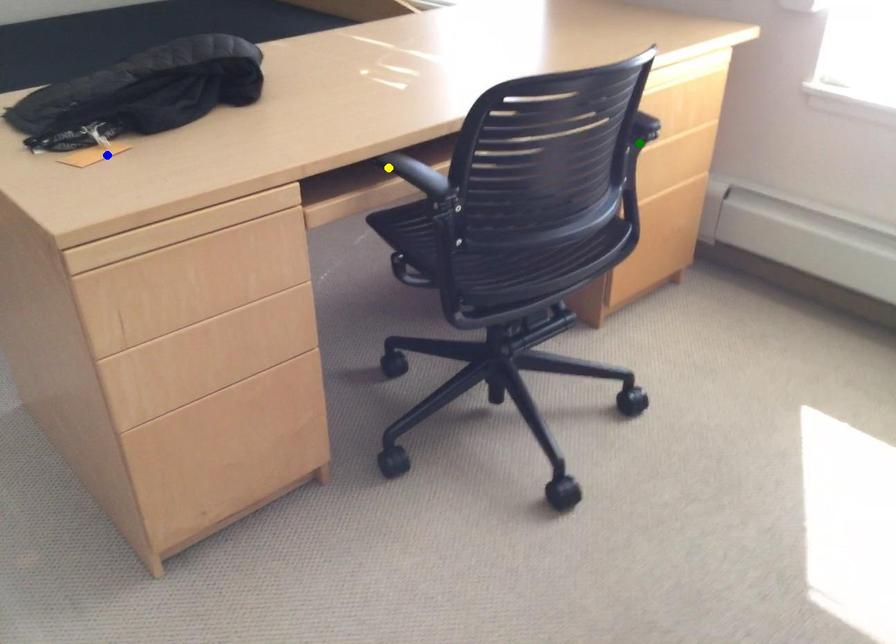
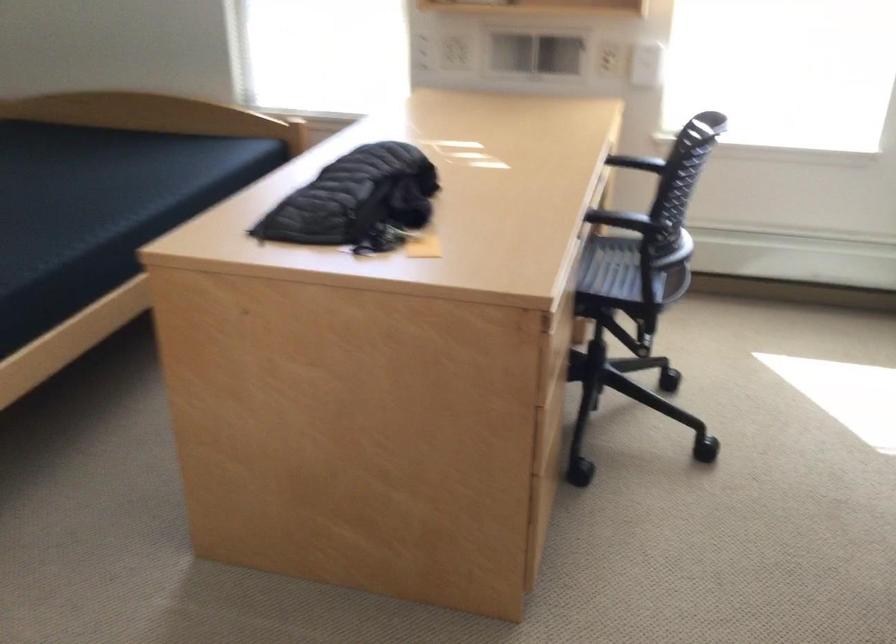
I am providing you with two images of the same scene from different viewpoints. Three points are marked in image1. Which point corresponds to a part or object that is occluded in image2?In image1, three points are marked. Which of them correspond to a part or object that is occluded in image2?Among the three points shown in image1, which one corresponds to a part or object that is no longer visible due to occlusion in image2?

green point